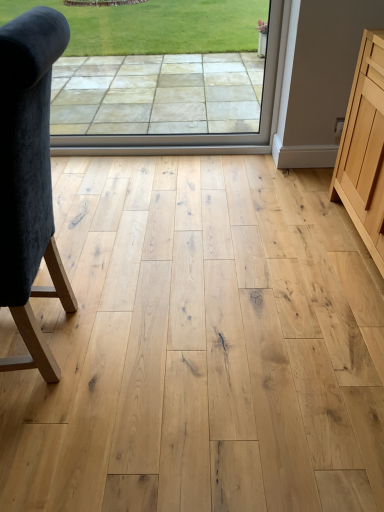
At what (x,y) coordinates should I click in order to perform the action: click on free space between velvet dark blue chair at left and natural wood cabinet at right. Please return your answer as a coordinate pair (x, y). The image size is (384, 512). Looking at the image, I should click on (238, 286).